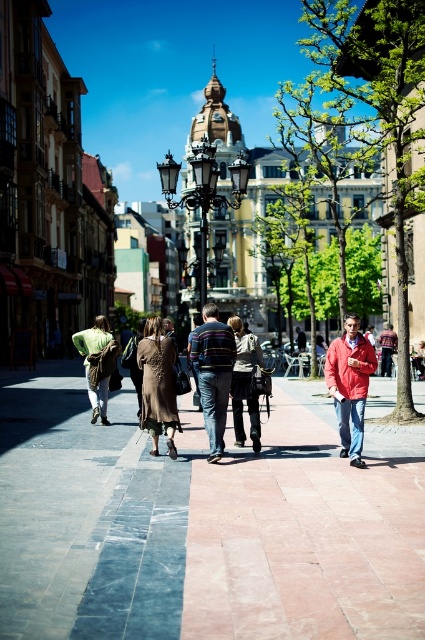
Question: In this image, where is marble pavement at center located relative to dark brown leather jacket at center?

Choices:
 (A) left
 (B) right

Answer: (A)

Question: Which point is farther to the camera?

Choices:
 (A) (25, 499)
 (B) (243, 429)

Answer: (B)

Question: Which point is closer to the camera?

Choices:
 (A) marble pavement at center
 (B) green fabric bag at center
 (C) dark brown leather jacket at center
 (D) brown textured dress at center

Answer: (A)

Question: Which point is closer to the camera?

Choices:
 (A) red plaid shirt at center
 (B) red matte jacket at center
 (C) marble pavement at center
 (D) brown textured dress at center

Answer: (C)

Question: Is marble pavement at center below dark brown leather jacket at center?

Choices:
 (A) yes
 (B) no

Answer: (A)

Question: Does brown textured dress at center have a greater width compared to green fabric bag at center?

Choices:
 (A) yes
 (B) no

Answer: (A)